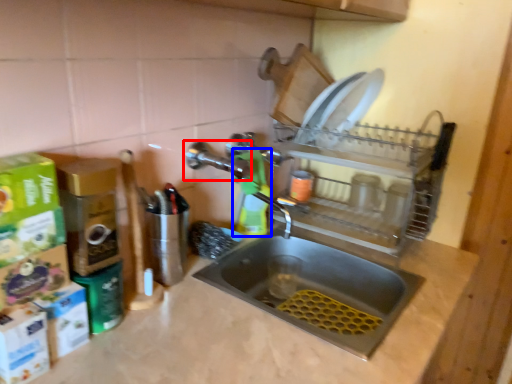
Question: Which point is further to the camera, tap (highlighted by a red box) or cleaning product (highlighted by a blue box)?

Choices:
 (A) tap
 (B) cleaning product

Answer: (B)